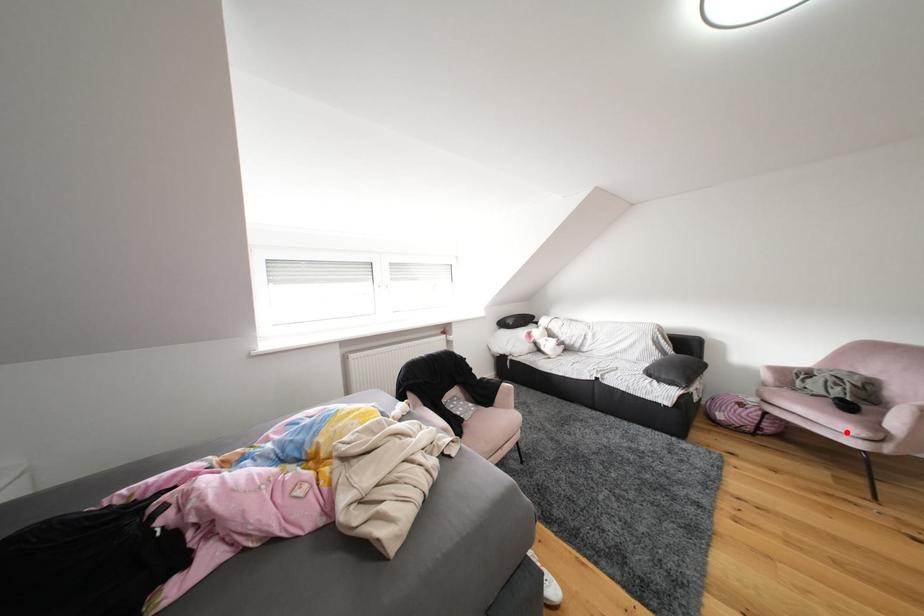
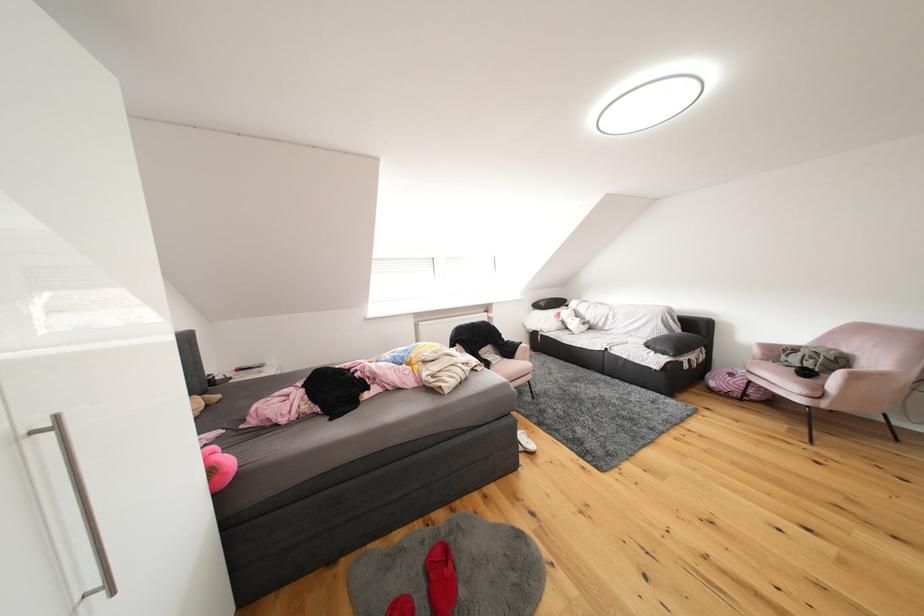
Question: I am providing you with two images of the same scene from different viewpoints. Image1 has a red point marked. In image2, the corresponding 3D location appears at what relative position? Reply with the corresponding letter.

Choices:
 (A) Closer
 (B) Farther

Answer: (B)